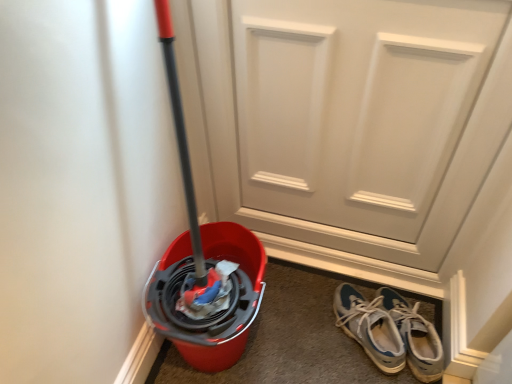
Question: Is white matte door at center inside or outside of blue suede sneakers at lower right?

Choices:
 (A) inside
 (B) outside

Answer: (B)

Question: In terms of width, does white matte door at center look wider or thinner when compared to blue suede sneakers at lower right?

Choices:
 (A) thin
 (B) wide

Answer: (A)

Question: Relative to blue suede sneakers at lower right, is white matte door at center in front or behind?

Choices:
 (A) behind
 (B) front

Answer: (B)

Question: From the image's perspective, is blue suede sneakers at lower right above or below white matte door at center?

Choices:
 (A) above
 (B) below

Answer: (B)

Question: Considering their positions, is blue suede sneakers at lower right located in front of or behind white matte door at center?

Choices:
 (A) behind
 (B) front

Answer: (A)

Question: Is point (380, 317) positioned closer to the camera than point (272, 99)?

Choices:
 (A) closer
 (B) farther

Answer: (B)

Question: In terms of height, does blue suede sneakers at lower right look taller or shorter compared to white matte door at center?

Choices:
 (A) tall
 (B) short

Answer: (B)